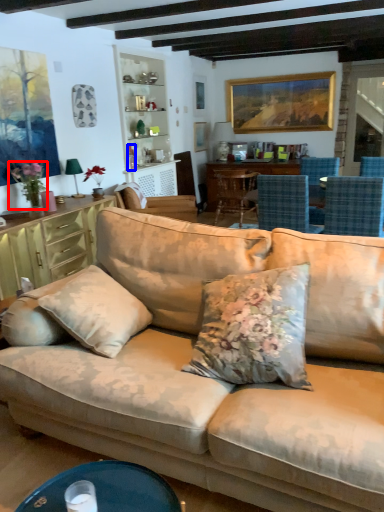
Question: Among these objects, which one is nearest to the camera, flower (highlighted by a red box) or corded phone (highlighted by a blue box)?

Choices:
 (A) flower
 (B) corded phone

Answer: (A)